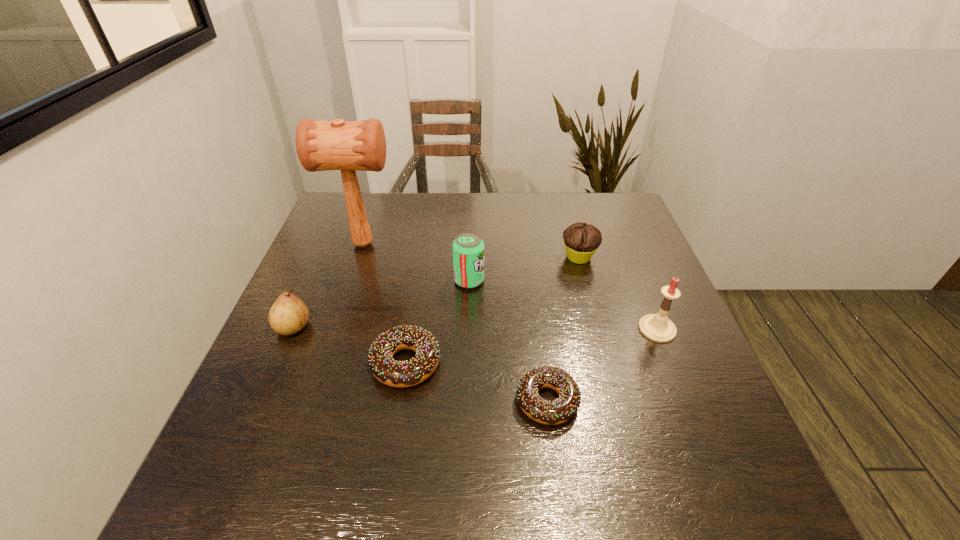
Find the location of a particular element. free location that satisfies the following two spatial constraints: 1. on the strike surface of the tallest object; 2. on the back side of the shortest object is located at coordinates (312, 401).

Where is `vacant space that satisfies the following two spatial constraints: 1. on the strike surface of the third shortest object; 2. on the right side of the mallet`? vacant space that satisfies the following two spatial constraints: 1. on the strike surface of the third shortest object; 2. on the right side of the mallet is located at coordinates [359, 257].

Identify the location of vacant space that satisfies the following two spatial constraints: 1. on the front-facing side of the fourth object from right to left; 2. on the left side of the rightmost object. The height and width of the screenshot is (540, 960). (468, 329).

This screenshot has width=960, height=540. I want to click on vacant area in the image that satisfies the following two spatial constraints: 1. on the strike surface of the mallet; 2. on the left side of the taller doughnut, so click(324, 363).

This screenshot has width=960, height=540. I want to click on vacant space that satisfies the following two spatial constraints: 1. on the strike surface of the tallest object; 2. on the right side of the right doughnut, so click(x=312, y=401).

Find the location of a particular element. This screenshot has width=960, height=540. vacant area in the image that satisfies the following two spatial constraints: 1. on the back side of the second object from right to left; 2. on the right side of the taller doughnut is located at coordinates (422, 257).

Locate an element on the screen. free region that satisfies the following two spatial constraints: 1. on the strike surface of the mallet; 2. on the right side of the candle is located at coordinates (335, 329).